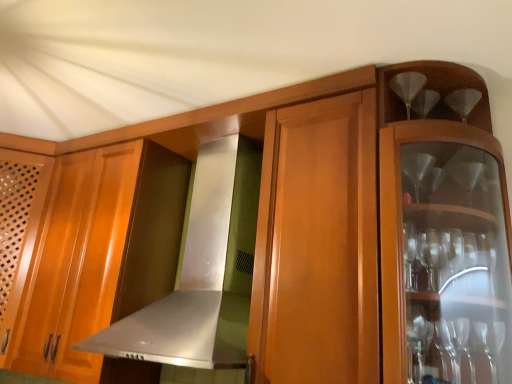
Question: In terms of size, does satin silver exhaust hood at center appear bigger or smaller than clear glass wine glass at upper right?

Choices:
 (A) small
 (B) big

Answer: (B)

Question: In terms of width, does satin silver exhaust hood at center look wider or thinner when compared to clear glass wine glass at upper right?

Choices:
 (A) thin
 (B) wide

Answer: (B)

Question: Estimate the real-world distances between objects in this image. Which object is closer to the satin silver exhaust hood at center?

Choices:
 (A) wooden cabinet at left
 (B) clear glass wine glass at upper right

Answer: (A)

Question: Which object is positioned farthest from the satin silver exhaust hood at center?

Choices:
 (A) clear glass wine glass at upper right
 (B) wooden cabinet at left

Answer: (A)